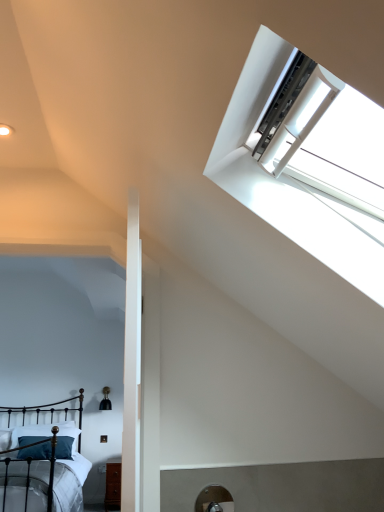
Question: From the image's perspective, is dark blue fabric pillow at lower left positioned above or below white plastic window at upper right?

Choices:
 (A) below
 (B) above

Answer: (A)

Question: Is dark blue fabric pillow at lower left in front of or behind white plastic window at upper right in the image?

Choices:
 (A) front
 (B) behind

Answer: (B)

Question: Which object is positioned closest to the black wrought iron bed at lower left?

Choices:
 (A) dark blue fabric pillow at lower left
 (B) white plastic window at upper right

Answer: (A)

Question: Estimate the real-world distances between objects in this image. Which object is closer to the black wrought iron bed at lower left?

Choices:
 (A) dark blue fabric pillow at lower left
 (B) white plastic window at upper right

Answer: (A)